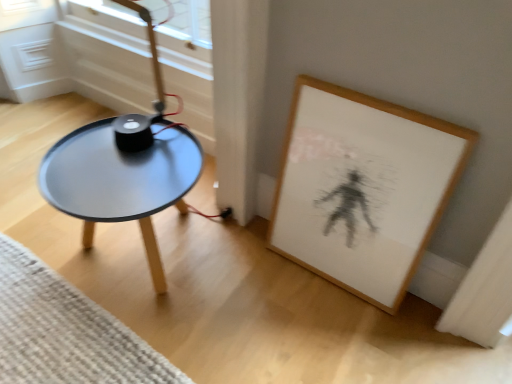
Identify the location of vacant space in matte black table at left (from a real-world perspective). (140, 258).